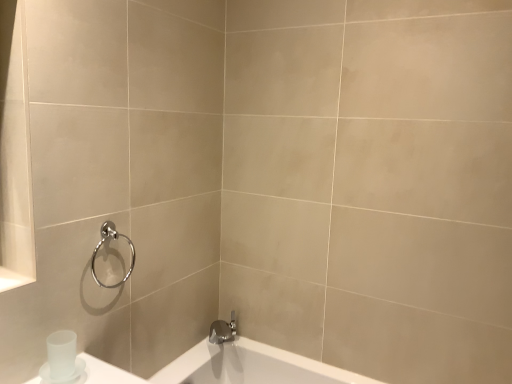
Question: In terms of height, does satin nickel faucet at lower center look taller or shorter compared to satin white cup at lower left?

Choices:
 (A) tall
 (B) short

Answer: (B)

Question: Considering the positions of satin nickel faucet at lower center and satin white cup at lower left in the image, is satin nickel faucet at lower center wider or thinner than satin white cup at lower left?

Choices:
 (A) wide
 (B) thin

Answer: (A)

Question: Estimate the real-world distances between objects in this image. Which object is farther from the polished chrome towel ring at upper left?

Choices:
 (A) satin white cup at lower left
 (B) satin nickel faucet at lower center

Answer: (B)

Question: Considering the real-world distances, which object is farthest from the satin nickel faucet at lower center?

Choices:
 (A) satin white cup at lower left
 (B) polished chrome towel ring at upper left

Answer: (A)